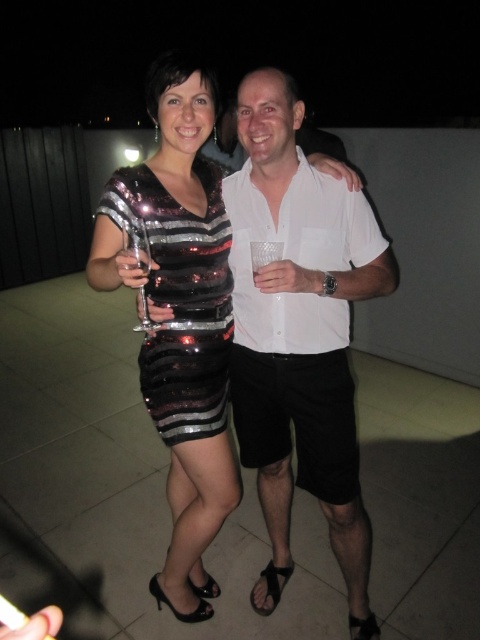
You are a photographer trying to capture the scene from the rooftop. You need to focus your camera on the white matte shirt at center. According to the coordinates provided, where should you aim your camera?

The white matte shirt at center is located at point (x=300, y=333), so you should aim your camera at those coordinates to focus on it.

Based on the photo, you are a photographer trying to capture a closeup of the clear glass wine glass at center without the white matte shirt at center overlapping it. Based on their sizes, is this possible?

The white matte shirt at center is bigger than clear glass wine glass at center, so it might be difficult to avoid overlap since the shirt is larger and closer in proximity.